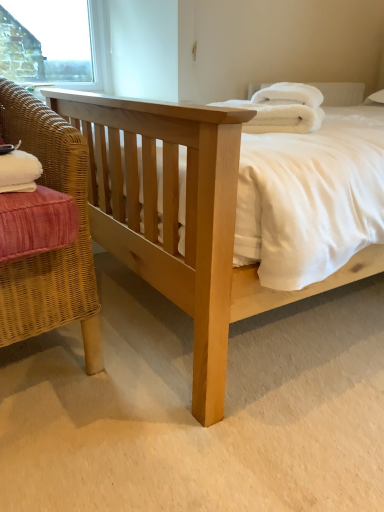
Question: Considering the relative positions of woven wicker chair at left and white plastic window frame at upper left in the image provided, is woven wicker chair at left to the left or to the right of white plastic window frame at upper left?

Choices:
 (A) right
 (B) left

Answer: (A)

Question: From the image's perspective, is woven wicker chair at left positioned above or below white plastic window frame at upper left?

Choices:
 (A) below
 (B) above

Answer: (A)

Question: Which object is positioned farthest from the white fluffy pillow at upper center?

Choices:
 (A) woven wicker chair at left
 (B) white fluffy bath towel at upper right
 (C) natural wood bed at center
 (D) white plastic window frame at upper left

Answer: (D)

Question: Which of these objects is positioned farthest from the white fluffy bath towel at upper right?

Choices:
 (A) white fluffy pillow at upper center
 (B) woven wicker chair at left
 (C) natural wood bed at center
 (D) white plastic window frame at upper left

Answer: (D)